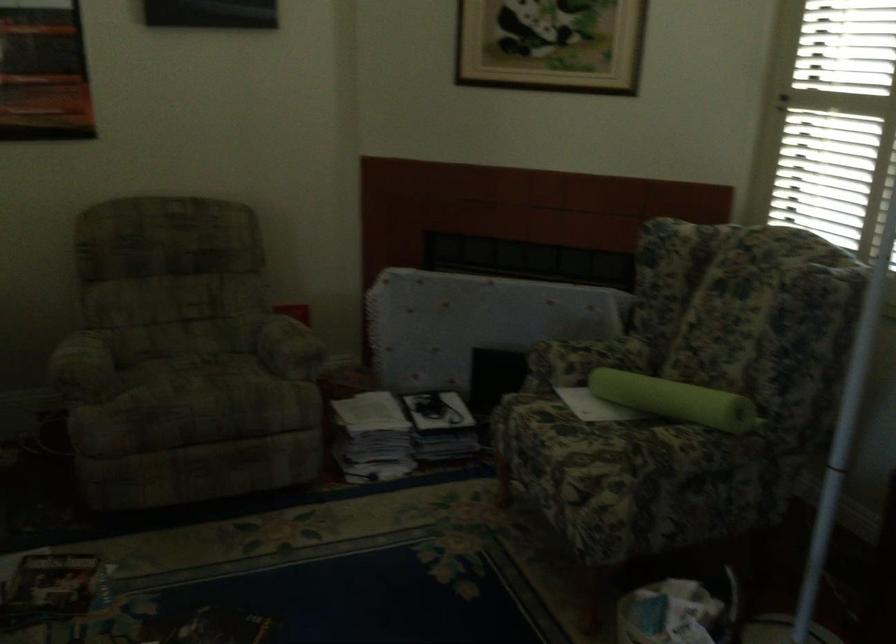
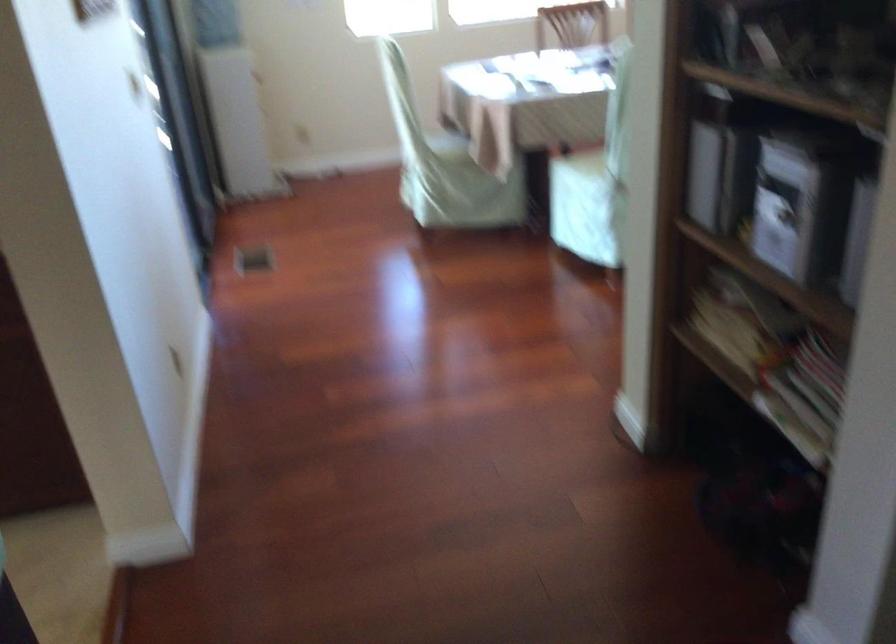
How did the camera likely rotate?

The camera's rotation is toward left-down.